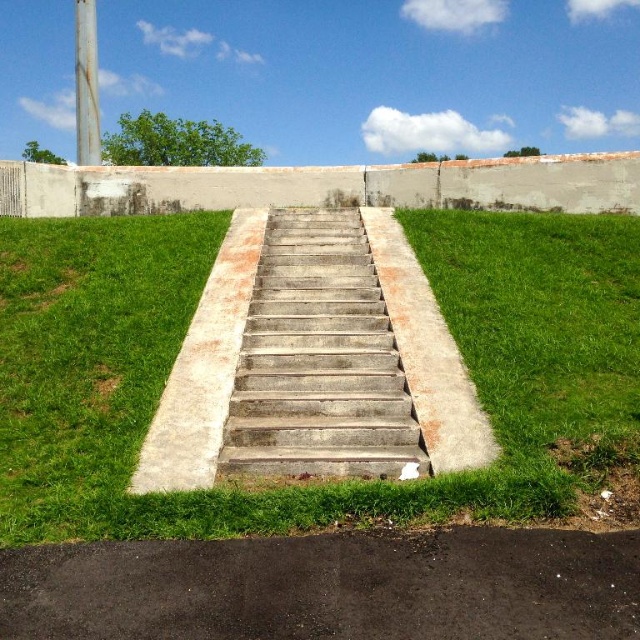
Can you confirm if dark gray asphalt at lower center is taller than concrete/stained stairs at center?

In fact, dark gray asphalt at lower center may be shorter than concrete/stained stairs at center.

Does dark gray asphalt at lower center have a greater width compared to concrete/stained stairs at center?

Indeed, dark gray asphalt at lower center has a greater width compared to concrete/stained stairs at center.

Is point (45, 609) positioned after point (381, 392)?

That is False.

Where is `dark gray asphalt at lower center`? dark gray asphalt at lower center is located at coordinates (330, 588).

Is green grass at center below dark gray asphalt at lower center?

No.

In the scene shown: Is green grass at center positioned in front of dark gray asphalt at lower center?

No.

Who is more distant from viewer, (x=490, y=500) or (x=113, y=579)?

The point (x=490, y=500) is behind.

Image resolution: width=640 pixels, height=640 pixels. I want to click on green grass at center, so click(x=321, y=484).

Is green grass at center bigger than concrete/stained stairs at center?

Yes.

Between point (442, 308) and point (253, 392), which one is positioned behind?

The point (442, 308) is behind.

Locate an element on the screen. This screenshot has height=640, width=640. green grass at center is located at coordinates (321, 484).